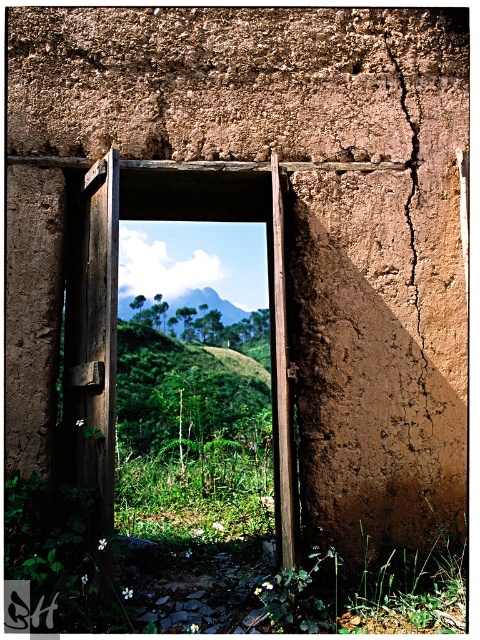
You are standing in front of the rustic wooden door and want to determine the relative positions of two points marked in the scene. Which point, point (99, 268) or point (396, 67), is closer to you?

Point (99, 268) is closer to the viewer than point (396, 67).

You are standing in front of the rustic wooden door and see two points marked on the wall. The first point is at coordinates point (276, 509) and the second is at point (195, 305). Which point is closer to you?

Point (276, 509) is in front of point (195, 305), so it is closer to you.